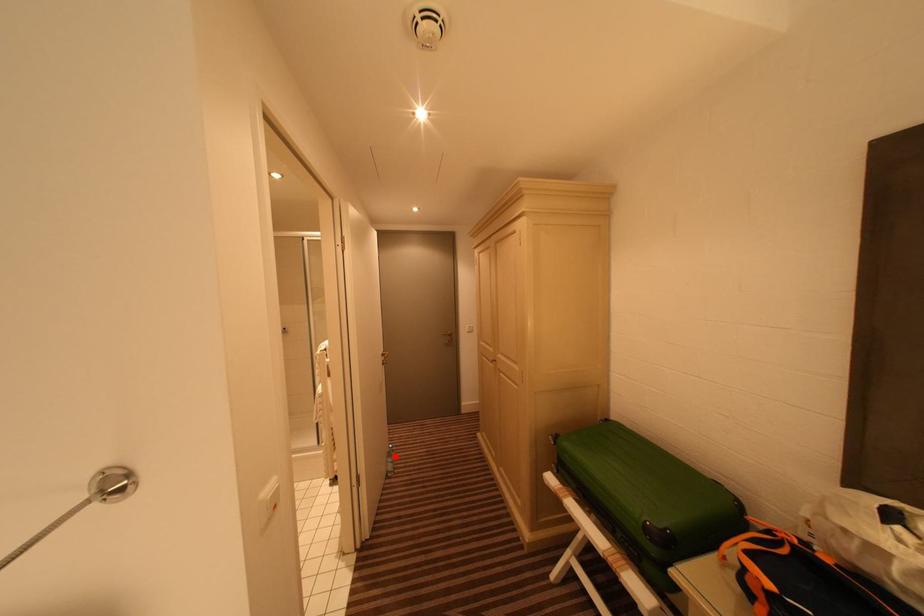
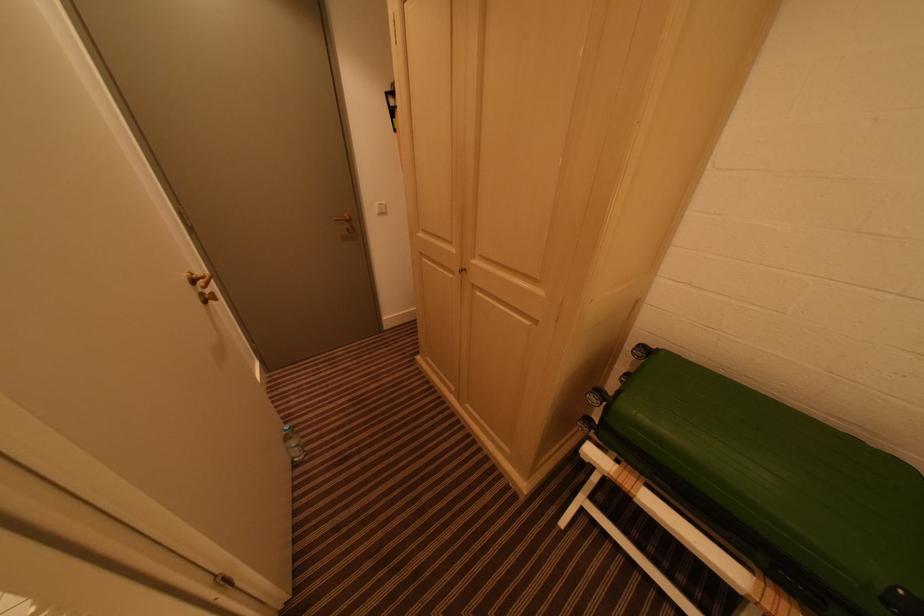
Question: I am providing you with two images of the same scene from different viewpoints. Given a red point in image1, look at the same physical point in image2. Is it:

Choices:
 (A) Closer to the viewpoint
 (B) Farther from the viewpoint

Answer: (A)